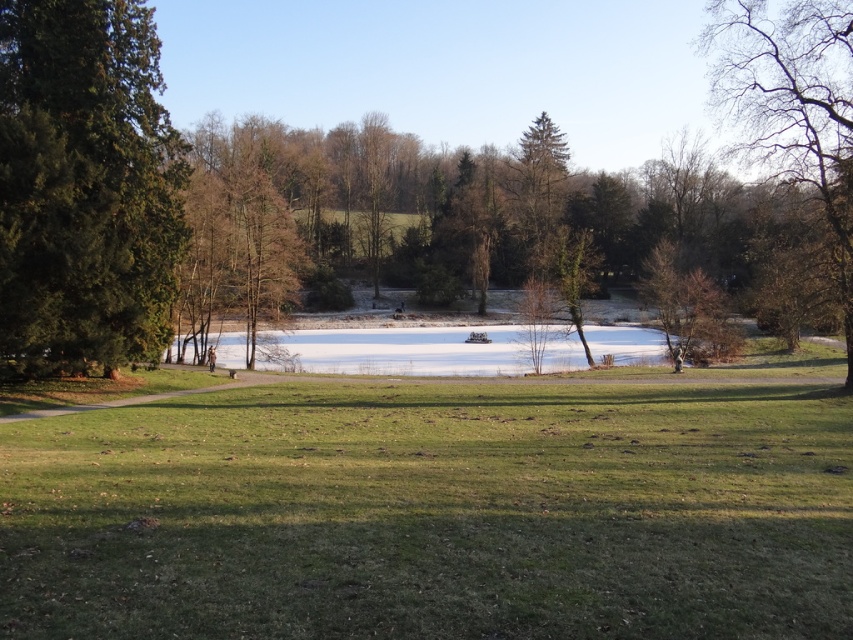
Question: Which object is positioned closest to the green grassy at center?

Choices:
 (A) bare branches at upper right
 (B) green textured tree at left

Answer: (B)

Question: Is green grassy at center bigger than green textured tree at left?

Choices:
 (A) no
 (B) yes

Answer: (A)

Question: Which of the following is the farthest from the observer?

Choices:
 (A) bare branches at upper right
 (B) green textured tree at left

Answer: (A)

Question: Can you confirm if green textured tree at left is wider than bare branches at upper right?

Choices:
 (A) yes
 (B) no

Answer: (B)

Question: Observing the image, what is the correct spatial positioning of green grassy at center in reference to bare branches at upper right?

Choices:
 (A) below
 (B) above

Answer: (A)

Question: Which object appears farthest from the camera in this image?

Choices:
 (A) bare branches at upper right
 (B) green grassy at center

Answer: (A)